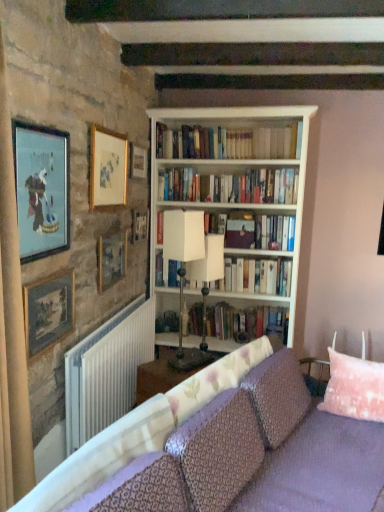
Measure the distance between point (204, 283) and camera.

Point (204, 283) and camera are 9.45 feet apart from each other.

Identify the location of gold-framed picture at upper left, which ranks as the third picture frame in front-to-back order. The height and width of the screenshot is (512, 384). (107, 168).

In the scene shown: In order to face white paperbacks at center, the 3th book positioned from the bottom, should I rotate leftwards or rightwards?

Turn right by 4.429 degrees to look at white paperbacks at center, the 3th book positioned from the bottom.

This screenshot has width=384, height=512. Describe the element at coordinates (138, 162) in the screenshot. I see `wooden picture frame at upper center, which ranks as the second picture frame in back-to-front order` at that location.

The image size is (384, 512). What are the coordinates of `white fabric table lamp at center, the first table lamp positioned from the right` in the screenshot? It's located at (207, 273).

How many degrees apart are the facing directions of wooden picture frame at upper left, acting as the fourth picture frame starting from the front, and white plastic radiator at lower left?

The angular difference between wooden picture frame at upper left, acting as the fourth picture frame starting from the front, and white plastic radiator at lower left is 1.18 degrees.

Is wooden picture frame at upper left, acting as the fourth picture frame starting from the front, inside or outside of white plastic radiator at lower left?

wooden picture frame at upper left, acting as the fourth picture frame starting from the front, is not enclosed by white plastic radiator at lower left.

Which is in front, point (116, 263) or point (67, 418)?

The point (67, 418) is in front.

Does point (173, 252) lie in front of point (45, 237)?

No, it is behind (45, 237).

Is the position of white matte table lamp at center, the 1th table lamp from the left, less distant than that of matte gold picture frame at upper left, which is the 1th picture frame from front to back?

No, it is not.

From a real-world perspective, is white matte table lamp at center, the 1th table lamp from the left, positioned above or below matte gold picture frame at upper left, which is the 1th picture frame from front to back?

From a real-world perspective, white matte table lamp at center, the 1th table lamp from the left, is physically below matte gold picture frame at upper left, which is the 1th picture frame from front to back.

Which object is more forward, white plastic radiator at lower left or wooden picture frame at upper center, which is counted as the fifth picture frame, starting from the front?

white plastic radiator at lower left is closer to the camera.

From the image's perspective, relative to wooden picture frame at upper center, which ranks as the second picture frame in back-to-front order, is white plastic radiator at lower left above or below?

white plastic radiator at lower left is situated lower than wooden picture frame at upper center, which ranks as the second picture frame in back-to-front order, in the image.

Is point (106, 358) closer to viewer compared to point (134, 166)?

Yes, it is in front of point (134, 166).

From the image's perspective, is white paperbacks at center, the 3th book positioned from the bottom, above wooden picture frame at upper center, the 1th picture frame viewed from the back?

Yes.

Can you confirm if white paperbacks at center, the 3th book positioned from the bottom, is thinner than wooden picture frame at upper center, the 6th picture frame positioned from the front?

In fact, white paperbacks at center, the 3th book positioned from the bottom, might be wider than wooden picture frame at upper center, the 6th picture frame positioned from the front.

Would you consider white paperbacks at center, which appears as the second book when viewed from the top, to be distant from wooden picture frame at upper center, the 6th picture frame positioned from the front?

white paperbacks at center, which appears as the second book when viewed from the top, is near wooden picture frame at upper center, the 6th picture frame positioned from the front, not far away.

From the wooden picture frame at upper center, the 1th picture frame viewed from the back, count 2nd book to the right and point to it. Please provide its 2D coordinates.

[(229, 186)]

Considering the relative sizes of purple fabric couch at lower center and white paperbacks at center, the 3th book positioned from the bottom, in the image provided, is purple fabric couch at lower center smaller than white paperbacks at center, the 3th book positioned from the bottom,?

Actually, purple fabric couch at lower center might be larger than white paperbacks at center, the 3th book positioned from the bottom.

Is white paperbacks at center, which appears as the second book when viewed from the top, inside purple fabric couch at lower center?

No, white paperbacks at center, which appears as the second book when viewed from the top, is not surrounded by purple fabric couch at lower center.

Is purple fabric couch at lower center far from white paperbacks at center, which appears as the second book when viewed from the top?

Yes, purple fabric couch at lower center is far from white paperbacks at center, which appears as the second book when viewed from the top.

Is purple fabric couch at lower center taller than white paperbacks at center, which appears as the second book when viewed from the top?

Yes, purple fabric couch at lower center is taller than white paperbacks at center, which appears as the second book when viewed from the top.

Could you tell me if white fabric table lamp at center, the 2th table lamp when ordered from left to right, is turned towards wooden picture frame at upper center, which ranks as the second picture frame in back-to-front order?

No.

Between white fabric table lamp at center, the first table lamp positioned from the right, and wooden picture frame at upper center, which is counted as the fifth picture frame, starting from the front, which one has smaller width?

wooden picture frame at upper center, which is counted as the fifth picture frame, starting from the front.

Which is behind, point (195, 263) or point (142, 157)?

The point (142, 157) is farther from the camera.

Are white fabric table lamp at center, the first table lamp positioned from the right, and wooden picture frame at upper center, which is counted as the fifth picture frame, starting from the front, located far from each other?

No, white fabric table lamp at center, the first table lamp positioned from the right, is not far from wooden picture frame at upper center, which is counted as the fifth picture frame, starting from the front.

Is white paper book at center, which appears as the third book when viewed from the top, situated inside white matte table lamp at center, the 1th table lamp from the left, or outside?

white paper book at center, which appears as the third book when viewed from the top, exists outside the volume of white matte table lamp at center, the 1th table lamp from the left.

Looking at their sizes, would you say white paper book at center, which appears as the third book when viewed from the top, is wider or thinner than white matte table lamp at center, the 1th table lamp from the left?

In the image, white paper book at center, which appears as the third book when viewed from the top, appears to be wider than white matte table lamp at center, the 1th table lamp from the left.

Looking at this image, from a real-world perspective, relative to white matte table lamp at center, the 1th table lamp from the left, is white paper book at center, which appears as the third book when viewed from the top, vertically above or below?

In terms of real-world spatial position, white paper book at center, which appears as the third book when viewed from the top, is below white matte table lamp at center, the 1th table lamp from the left.

Identify the location of radiator lying below the wooden picture frame at upper left, acting as the fourth picture frame starting from the front (from the image's perspective). Image resolution: width=384 pixels, height=512 pixels. (106, 372).

Starting from the matte gold picture frame at upper left, which is the 1th picture frame from front to back, which table lamp is the 1st one to the right? Please provide its 2D coordinates.

[(184, 271)]

From the image, which object appears to be farther from wooden picture frame at upper center, the 1th picture frame viewed from the back, pink fabric pillow at right or purple fabric couch at lower center?

The object further to wooden picture frame at upper center, the 1th picture frame viewed from the back, is pink fabric pillow at right.

When comparing their distances from white matte table lamp at center, the 1th table lamp from the left, does gold-framed picture at upper left, which ranks as the third picture frame in front-to-back order, or wooden picture frame at upper center, which is counted as the fifth picture frame, starting from the front, seem closer?

Based on the image, wooden picture frame at upper center, which is counted as the fifth picture frame, starting from the front, appears to be nearer to white matte table lamp at center, the 1th table lamp from the left.

Estimate the real-world distances between objects in this image. Which object is further from hardcover books at center, placed as the first book when sorted from bottom to top, white paperbacks at center, which appears as the second book when viewed from the top, or white matte table lamp at center, the 1th table lamp from the left?

Among the two, white paperbacks at center, which appears as the second book when viewed from the top, is located further to hardcover books at center, placed as the first book when sorted from bottom to top.

Estimate the real-world distances between objects in this image. Which object is further from white paper book at center, which appears as the third book when viewed from the top, wooden picture frame at upper center, which ranks as the second picture frame in back-to-front order, or gold-framed picture at upper left, which ranks as the third picture frame in front-to-back order?

gold-framed picture at upper left, which ranks as the third picture frame in front-to-back order, lies further to white paper book at center, which appears as the third book when viewed from the top, than the other object.

Based on their spatial positions, is gold-framed picture at upper left, which ranks as the third picture frame in front-to-back order, or purple fabric couch at lower center closer to white matte table lamp at center, the 1th table lamp from the left?

purple fabric couch at lower center is positioned closer to the anchor white matte table lamp at center, the 1th table lamp from the left.

In the scene shown: Based on their spatial positions, is pink fabric pillow at right or purple fabric couch at lower center closer to wooden picture frame at upper center, which ranks as the second picture frame in back-to-front order?

Based on the image, purple fabric couch at lower center appears to be nearer to wooden picture frame at upper center, which ranks as the second picture frame in back-to-front order.

From the image, which object appears to be farther from wooden picture frame at upper center, the 6th picture frame positioned from the front, white paper book at center, which appears as the third book when viewed from the top, or matte gold picture frame at upper left, the sixth picture frame when ordered from back to front?

Based on the image, matte gold picture frame at upper left, the sixth picture frame when ordered from back to front, appears to be further to wooden picture frame at upper center, the 6th picture frame positioned from the front.

Which object lies further to the anchor point wooden picture frame at upper left, which appears as the third picture frame when viewed from the back, white matte table lamp at center, the 1th table lamp from the left, or white paperbacks at upper center, the fourth book when ordered from bottom to top?

white paperbacks at upper center, the fourth book when ordered from bottom to top, lies further to wooden picture frame at upper left, which appears as the third picture frame when viewed from the back, than the other object.

I want to click on table lamp between wooden picture frame at upper left, acting as the fourth picture frame starting from the front, and hardcover books at center, placed as the first book when sorted from bottom to top, from front to back, so click(x=207, y=273).

Locate an element on the screen. The width and height of the screenshot is (384, 512). bookcase located between matte gold picture frame at upper left, which is the 1th picture frame from front to back, and wooden picture frame at upper center, the 6th picture frame positioned from the front, in the depth direction is located at coordinates (236, 198).

I want to click on bookcase positioned between white plastic radiator at lower left and white paper book at center, the second book when ordered from bottom to top, from near to far, so pos(236,198).

You are a GUI agent. You are given a task and a screenshot of the screen. Output one action in this format:
    pyautogui.click(x=<x>, y=<y>)
    Task: Click on the bookcase between white fabric table lamp at center, the 2th table lamp when ordered from left to right, and hardcover books at center, the 4th book positioned from the top, from front to back
    
    Given the screenshot: What is the action you would take?
    pyautogui.click(x=236, y=198)